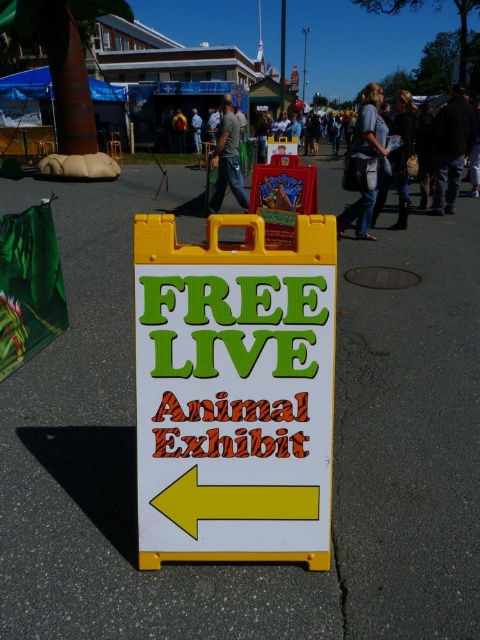
Is white plastic sign at center further to camera compared to denim jeans at center?

That is False.

Between white plastic sign at center and denim jeans at center, which one is positioned lower?

white plastic sign at center is lower down.

I want to click on white plastic sign at center, so click(233, 394).

Can you confirm if dark blue jeans at center is taller than matte yellow sign at center?

No.

Who is positioned more to the left, dark blue jeans at center or matte yellow sign at center?

matte yellow sign at center

Where is `dark blue jeans at center`? dark blue jeans at center is located at coordinates (451, 148).

Between denim jeans at center and dark blue shirt at center, which one has less height?

dark blue shirt at center is shorter.

Is denim jeans at center shorter than dark blue shirt at center?

No.

Locate an element on the screen. This screenshot has width=480, height=640. denim jeans at center is located at coordinates (363, 163).